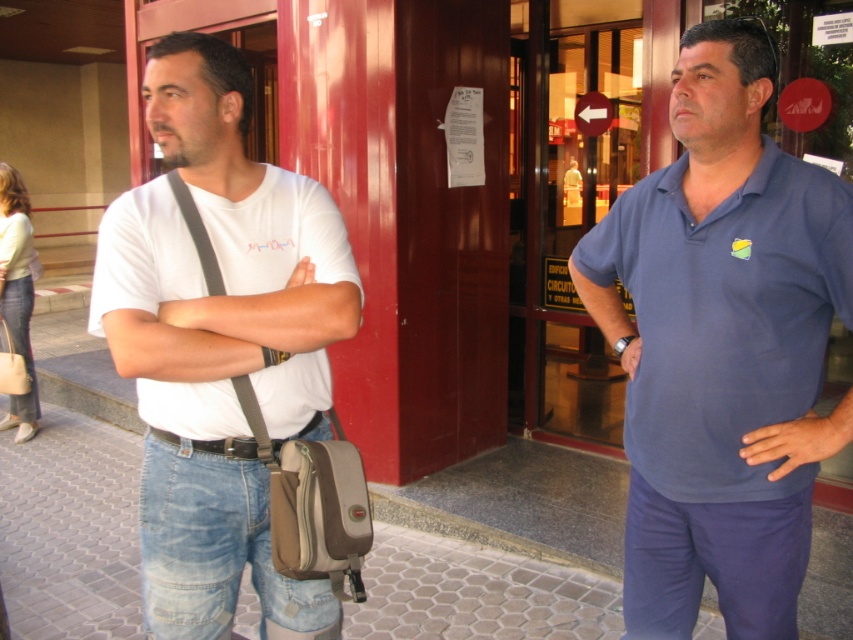
Question: Can you confirm if white cotton t-shirt at left is wider than black leather belt at center?

Choices:
 (A) no
 (B) yes

Answer: (B)

Question: Among these objects, which one is nearest to the camera?

Choices:
 (A) white matte t-shirt at center
 (B) blue cotton polo shirt at center
 (C) blue fabric arm at right
 (D) blue denim jeans at lower right

Answer: (A)

Question: Is blue cotton polo shirt at center positioned in front of white cotton t-shirt at left?

Choices:
 (A) no
 (B) yes

Answer: (A)

Question: Which point is closer to the camera taking this photo?

Choices:
 (A) (193, 554)
 (B) (605, 257)
 (C) (184, 403)
 (D) (149, 456)

Answer: (C)

Question: Is jeans at center bigger than jeans at left?

Choices:
 (A) yes
 (B) no

Answer: (B)

Question: Among these points, which one is nearest to the camera?

Choices:
 (A) (271, 449)
 (B) (587, 246)

Answer: (A)